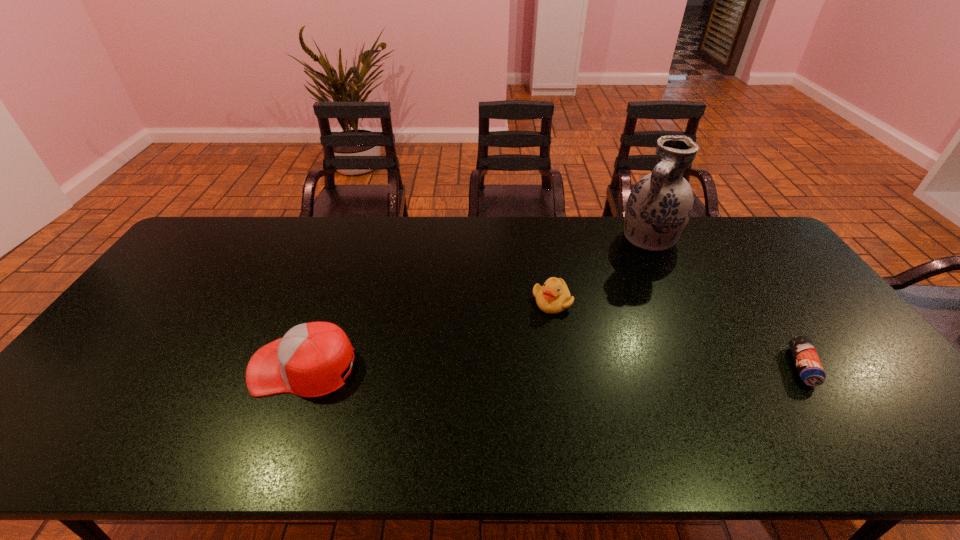
Find the location of a particular element. The height and width of the screenshot is (540, 960). beer can that is positioned at the near edge is located at coordinates (810, 369).

Find the location of a particular element. This screenshot has height=540, width=960. object located in the right edge section of the desktop is located at coordinates (810, 369).

The image size is (960, 540). I want to click on object located at the near right corner, so click(810, 369).

At what (x,y) coordinates should I click in order to perform the action: click on free region at the far edge of the desktop. Please return your answer as a coordinate pair (x, y). This screenshot has height=540, width=960. Looking at the image, I should click on (358, 253).

This screenshot has width=960, height=540. I want to click on free spot at the near edge of the desktop, so (567, 411).

Identify the location of free space at the right edge. (819, 323).

At what (x,y) coordinates should I click in order to perform the action: click on free point at the near right corner. Please return your answer as a coordinate pair (x, y). The height and width of the screenshot is (540, 960). Looking at the image, I should click on (838, 393).

Locate an element on the screen. The width and height of the screenshot is (960, 540). empty space between the baseball cap and the third object from right to left is located at coordinates 427,334.

Identify the location of free spot between the rightmost object and the third object from left to right. (726, 302).

I want to click on empty location between the vase and the shortest object, so click(726, 302).